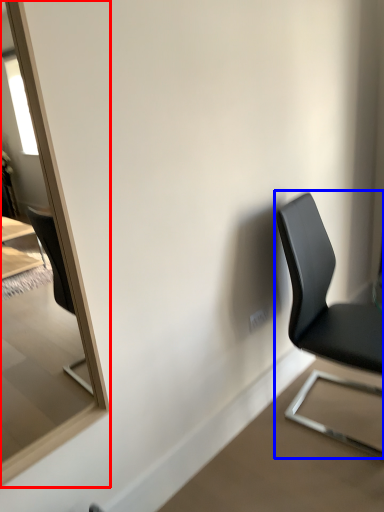
Question: Which object is closer to the camera taking this photo, mirror (highlighted by a red box) or chair (highlighted by a blue box)?

Choices:
 (A) mirror
 (B) chair

Answer: (A)